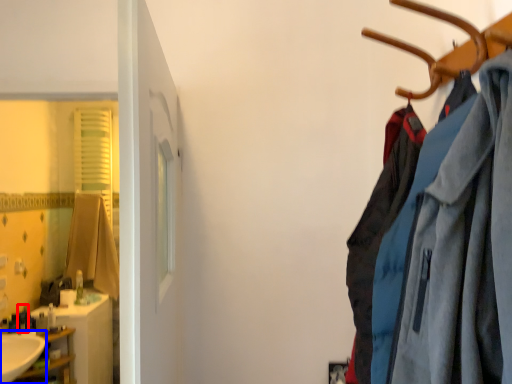
Question: Which point is further to the camera, toiletry (highlighted by a red box) or sink (highlighted by a blue box)?

Choices:
 (A) toiletry
 (B) sink

Answer: (A)